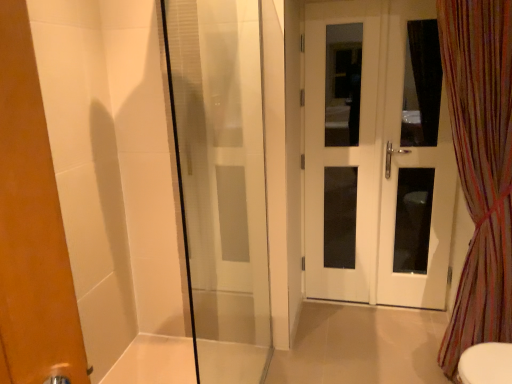
Question: Is white glossy door at right wider than transparent glass shower door at left?

Choices:
 (A) no
 (B) yes

Answer: (B)

Question: Is white glossy door at right far away from transparent glass shower door at left?

Choices:
 (A) no
 (B) yes

Answer: (A)

Question: Is white glossy door at right positioned before transparent glass shower door at left?

Choices:
 (A) yes
 (B) no

Answer: (B)

Question: Considering the relative sizes of white glossy door at right and transparent glass shower door at left in the image provided, is white glossy door at right bigger than transparent glass shower door at left?

Choices:
 (A) no
 (B) yes

Answer: (A)

Question: From a real-world perspective, is white glossy door at right located higher than transparent glass shower door at left?

Choices:
 (A) no
 (B) yes

Answer: (B)

Question: Can you confirm if white glossy door at right is smaller than transparent glass shower door at left?

Choices:
 (A) yes
 (B) no

Answer: (A)

Question: Is white glossy door at right not inside multicolored striped curtain at right?

Choices:
 (A) yes
 (B) no

Answer: (A)

Question: Is white glossy door at right positioned behind multicolored striped curtain at right?

Choices:
 (A) no
 (B) yes

Answer: (B)

Question: Does white glossy door at right have a smaller size compared to multicolored striped curtain at right?

Choices:
 (A) yes
 (B) no

Answer: (A)

Question: Considering the relative sizes of white glossy door at right and multicolored striped curtain at right in the image provided, is white glossy door at right shorter than multicolored striped curtain at right?

Choices:
 (A) no
 (B) yes

Answer: (A)

Question: From the image's perspective, would you say white glossy door at right is shown under multicolored striped curtain at right?

Choices:
 (A) no
 (B) yes

Answer: (A)

Question: Is the depth of white glossy door at right less than that of multicolored striped curtain at right?

Choices:
 (A) no
 (B) yes

Answer: (A)

Question: Does white glass door at right, which ranks as the second screen door in left-to-right order, come behind multicolored striped curtain at right?

Choices:
 (A) yes
 (B) no

Answer: (A)